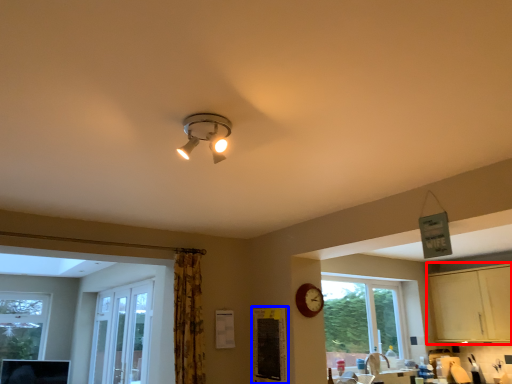
Question: Among these objects, which one is farthest to the camera, dresser (highlighted by a red box) or bulletin board (highlighted by a blue box)?

Choices:
 (A) dresser
 (B) bulletin board

Answer: (A)